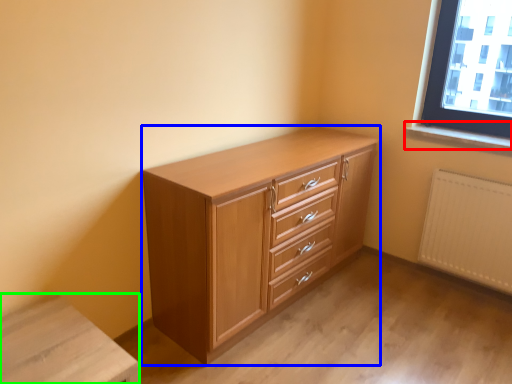
Question: Which object is positioned farthest from window sill (highlighted by a red box)? Select from chest of drawers (highlighted by a blue box) and changing table (highlighted by a green box).

Choices:
 (A) chest of drawers
 (B) changing table

Answer: (B)